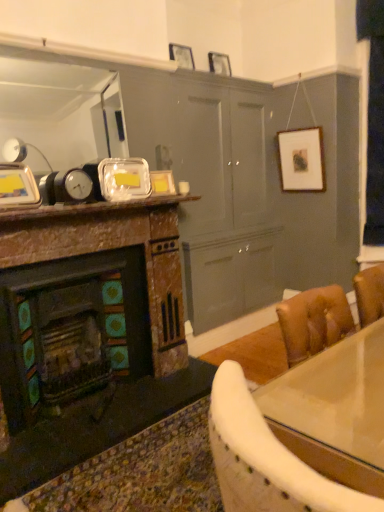
Question: Should I look upward or downward to see matte silver picture frame at upper center, the fifth picture frame from the bottom?

Choices:
 (A) down
 (B) up

Answer: (B)

Question: Should I look upward or downward to see matte glass picture frame at upper center, marked as the second picture frame in a bottom-to-top arrangement?

Choices:
 (A) down
 (B) up

Answer: (B)

Question: Does matte silver picture frame at upper center, marked as the 1th picture frame in a top-to-bottom arrangement, come behind rustic stone fireplace at left?

Choices:
 (A) yes
 (B) no

Answer: (A)

Question: Is matte silver picture frame at upper center, which is counted as the first picture frame, starting from the back, next to rustic stone fireplace at left?

Choices:
 (A) no
 (B) yes

Answer: (A)

Question: Could you tell me if matte silver picture frame at upper center, which is the 4th picture frame in left-to-right order, is turned towards rustic stone fireplace at left?

Choices:
 (A) no
 (B) yes

Answer: (A)

Question: From the image's perspective, is matte silver picture frame at upper center, the 2th picture frame positioned from the right, above rustic stone fireplace at left?

Choices:
 (A) yes
 (B) no

Answer: (A)

Question: Can you confirm if matte silver picture frame at upper center, which is counted as the first picture frame, starting from the back, is bigger than rustic stone fireplace at left?

Choices:
 (A) yes
 (B) no

Answer: (B)

Question: Considering the relative sizes of matte silver picture frame at upper center, marked as the 1th picture frame in a top-to-bottom arrangement, and rustic stone fireplace at left in the image provided, is matte silver picture frame at upper center, marked as the 1th picture frame in a top-to-bottom arrangement, taller than rustic stone fireplace at left?

Choices:
 (A) yes
 (B) no

Answer: (B)

Question: Does metallic silver picture frame at upper left, arranged as the 5th picture frame when viewed from the right, come behind wooden picture frame at upper center, the third picture frame viewed from the right?

Choices:
 (A) yes
 (B) no

Answer: (B)

Question: Is metallic silver picture frame at upper left, which ranks as the 5th picture frame in top-to-bottom order, positioned with its back to wooden picture frame at upper center, which is the second picture frame in top-to-bottom order?

Choices:
 (A) no
 (B) yes

Answer: (A)

Question: From a real-world perspective, is metallic silver picture frame at upper left, the 5th picture frame when ordered from back to front, beneath wooden picture frame at upper center, the third picture frame viewed from the right?

Choices:
 (A) yes
 (B) no

Answer: (A)

Question: Is metallic silver picture frame at upper left, which ranks as the 5th picture frame in top-to-bottom order, beside wooden picture frame at upper center, which is the second picture frame in top-to-bottom order?

Choices:
 (A) no
 (B) yes

Answer: (A)

Question: Can you confirm if metallic silver picture frame at upper left, the 5th picture frame when ordered from back to front, is smaller than wooden picture frame at upper center, which is the 4th picture frame from bottom to top?

Choices:
 (A) yes
 (B) no

Answer: (B)

Question: Is metallic silver picture frame at upper left, placed as the 1th picture frame when sorted from front to back, positioned far away from wooden picture frame at upper center, which is the 4th picture frame from bottom to top?

Choices:
 (A) no
 (B) yes

Answer: (B)

Question: Can you confirm if shiny glass table at lower right is thinner than rustic stone fireplace at left?

Choices:
 (A) yes
 (B) no

Answer: (B)